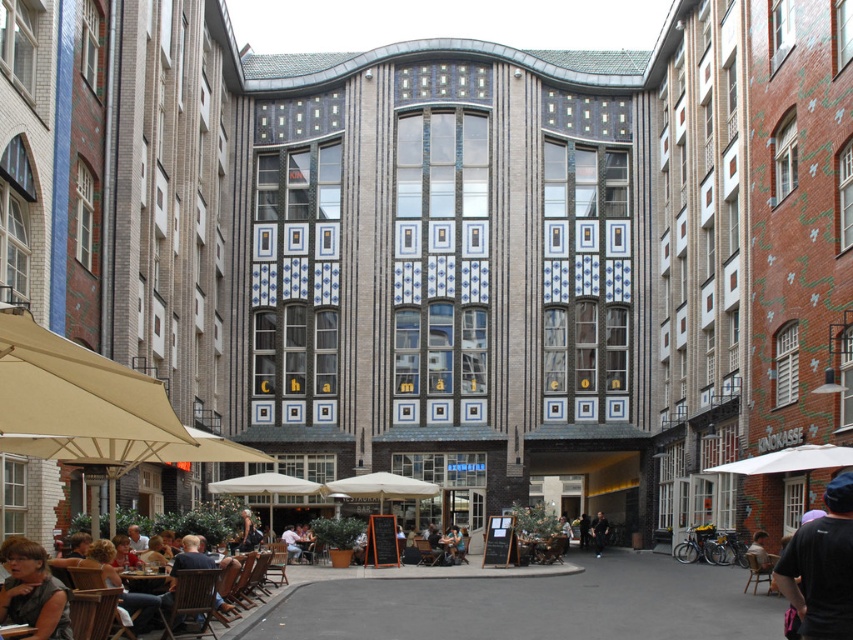
Question: Among these points, which one is farthest from the camera?

Choices:
 (A) (4, 627)
 (B) (606, 518)

Answer: (B)

Question: Does dark blue fabric cap at lower right have a larger size compared to black leather jacket at center?

Choices:
 (A) no
 (B) yes

Answer: (A)

Question: Which of the following is the farthest from the observer?

Choices:
 (A) dark blue fabric cap at lower right
 (B) dark gray fabric at lower left
 (C) wooden table at center
 (D) wooden table at lower left

Answer: (C)

Question: Which point is farther from the camera taking this photo?

Choices:
 (A) (820, 634)
 (B) (9, 632)
 (C) (135, 579)

Answer: (C)

Question: Can you confirm if dark blue fabric cap at lower right is positioned below wooden table at center?

Choices:
 (A) no
 (B) yes

Answer: (A)

Question: Can you confirm if dark gray fabric at lower left is positioned to the left of wooden table at center?

Choices:
 (A) yes
 (B) no

Answer: (A)